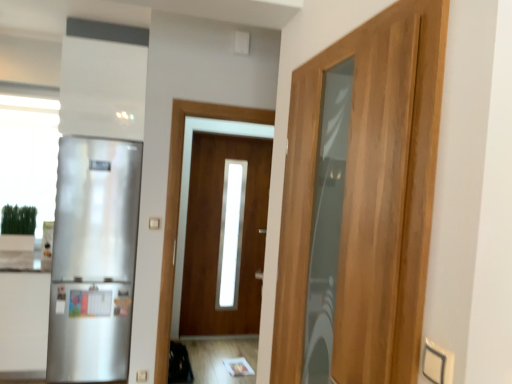
Question: Is satin silver refrigerator at left facing away from wooden door at right, which is the 1th door from right to left?

Choices:
 (A) yes
 (B) no

Answer: (B)

Question: Is satin silver refrigerator at left not near wooden door at right, the second door viewed from the left?

Choices:
 (A) no
 (B) yes

Answer: (B)

Question: From a real-world perspective, does satin silver refrigerator at left sit lower than wooden door at right, which is counted as the second door, starting from the back?

Choices:
 (A) no
 (B) yes

Answer: (B)

Question: Is satin silver refrigerator at left at the left side of wooden door at right, the second door viewed from the left?

Choices:
 (A) yes
 (B) no

Answer: (A)

Question: Is satin silver refrigerator at left oriented towards wooden door at right, which is the first door from front to back?

Choices:
 (A) no
 (B) yes

Answer: (A)

Question: In terms of size, does satin white cabinet at left appear bigger or smaller than satin silver refrigerator at left?

Choices:
 (A) big
 (B) small

Answer: (B)

Question: From a real-world perspective, is satin white cabinet at left positioned above or below satin silver refrigerator at left?

Choices:
 (A) below
 (B) above

Answer: (A)

Question: In the image, is satin white cabinet at left on the left side or the right side of satin silver refrigerator at left?

Choices:
 (A) left
 (B) right

Answer: (A)

Question: Considering the positions of satin white cabinet at left and satin silver refrigerator at left in the image, is satin white cabinet at left wider or thinner than satin silver refrigerator at left?

Choices:
 (A) thin
 (B) wide

Answer: (B)

Question: Which is correct: wooden door at right, which is the 1th door from right to left, is inside satin white cabinet at left, or outside of it?

Choices:
 (A) outside
 (B) inside

Answer: (A)

Question: From the image's perspective, relative to satin white cabinet at left, is wooden door at right, which is the first door from front to back, above or below?

Choices:
 (A) below
 (B) above

Answer: (B)

Question: Is wooden door at right, which is the first door from front to back, bigger or smaller than satin white cabinet at left?

Choices:
 (A) big
 (B) small

Answer: (B)

Question: In terms of height, does wooden door at right, which is the first door from front to back, look taller or shorter compared to satin white cabinet at left?

Choices:
 (A) tall
 (B) short

Answer: (A)

Question: In terms of size, does satin white cabinet at left appear bigger or smaller than wooden door at center, the second door when ordered from front to back?

Choices:
 (A) small
 (B) big

Answer: (B)

Question: Is satin white cabinet at left inside the boundaries of wooden door at center, the second door when ordered from front to back, or outside?

Choices:
 (A) inside
 (B) outside

Answer: (B)